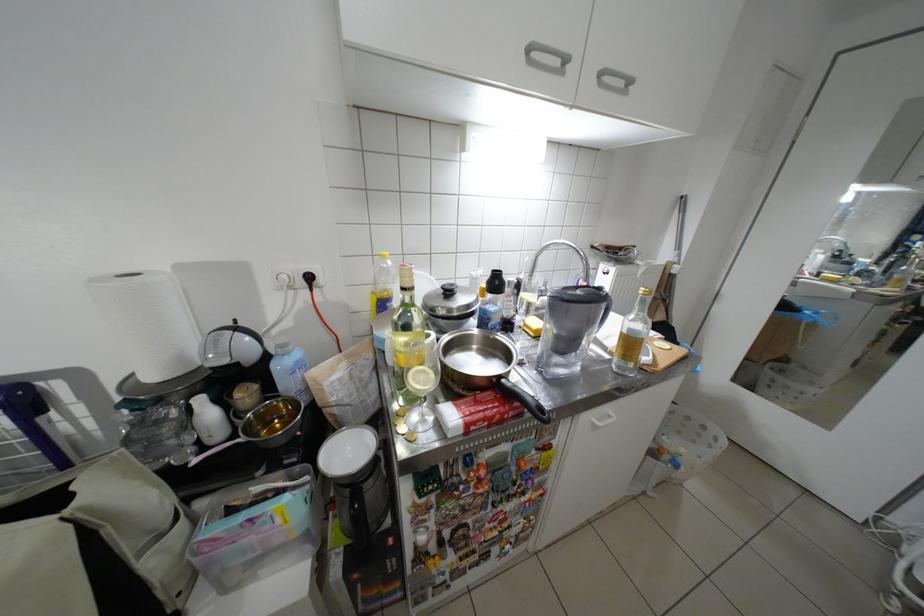
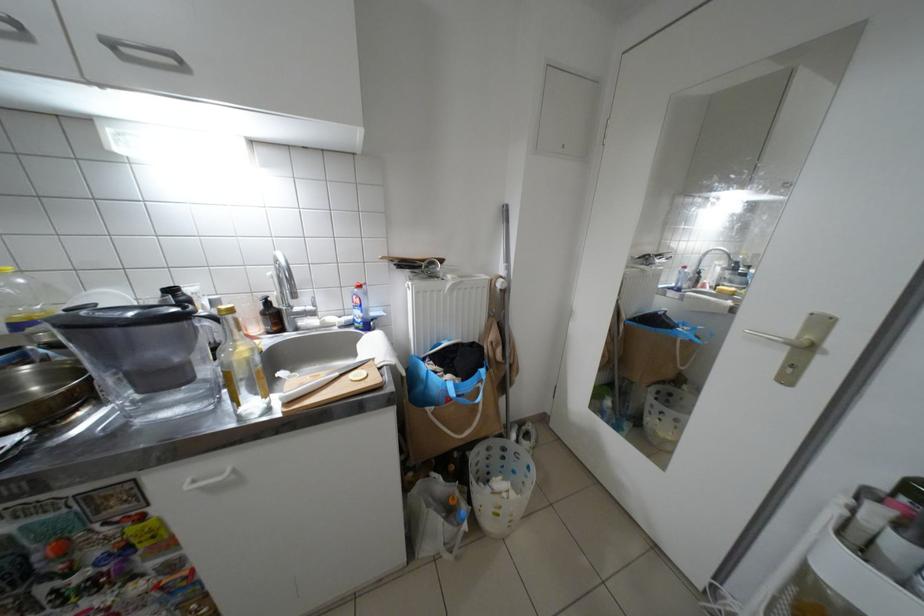
In the second image, find the point that corresponds to the point at 671,288 in the first image.

(502, 304)